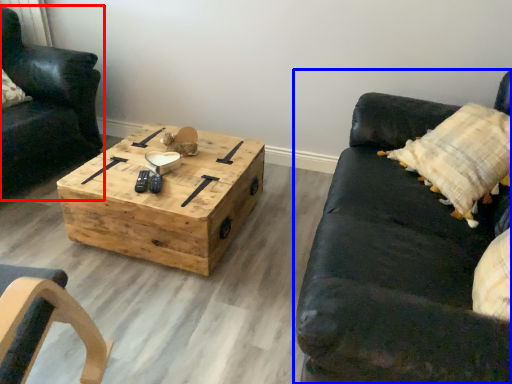
Question: Among these objects, which one is nearest to the camera, chair (highlighted by a red box) or studio couch (highlighted by a blue box)?

Choices:
 (A) chair
 (B) studio couch

Answer: (B)